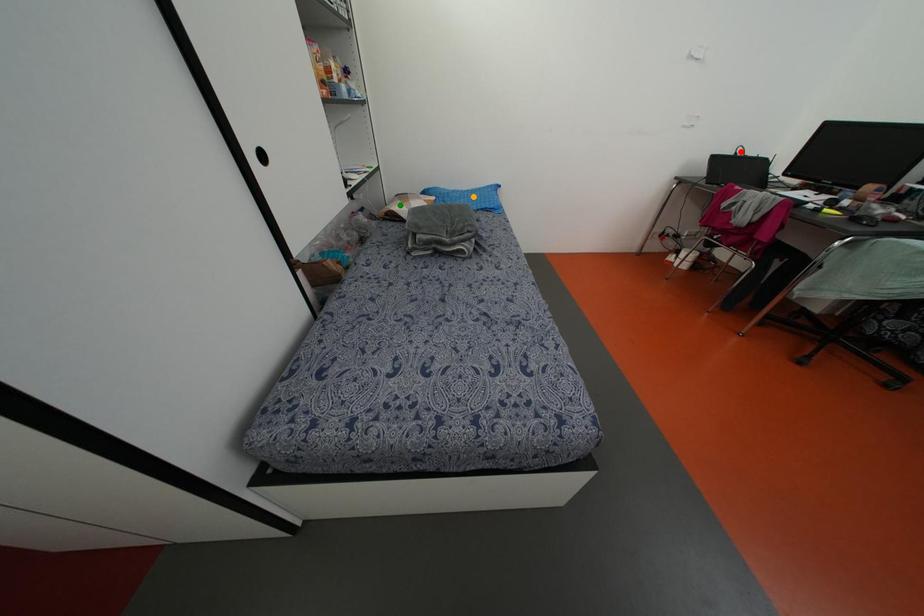
Order these from nearest to farthest:
orange point, red point, green point

red point < orange point < green point